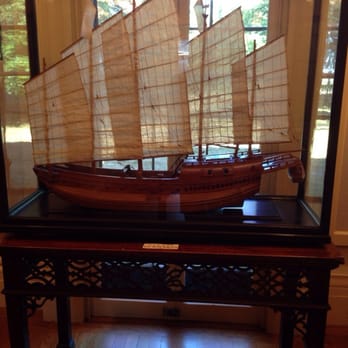
The width and height of the screenshot is (348, 348). Identify the location of intricate detail on table. (245, 280).